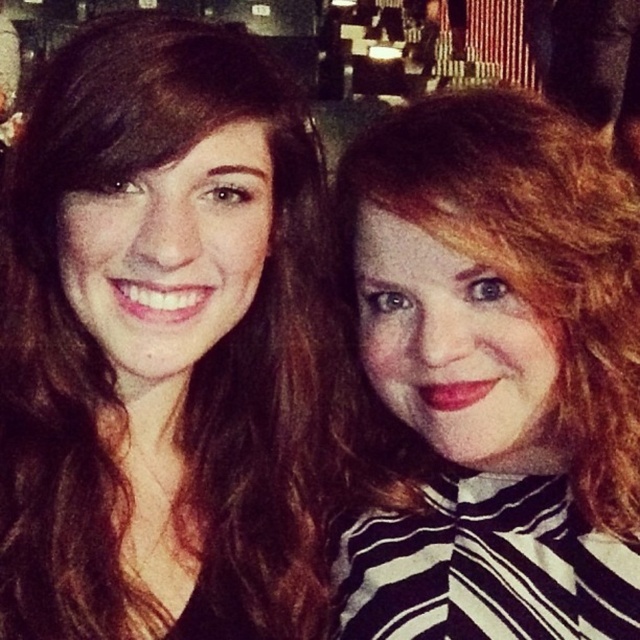
Question: Which of the following is the farthest from the observer?

Choices:
 (A) matte black hair at right
 (B) matte black hair at left

Answer: (A)

Question: Among these points, which one is farthest from the camera?

Choices:
 (A) (508, 314)
 (B) (19, 419)

Answer: (B)

Question: Is matte black hair at left in front of matte black hair at right?

Choices:
 (A) no
 (B) yes

Answer: (B)

Question: Which of the following is the farthest from the observer?

Choices:
 (A) matte black hair at left
 (B) matte black hair at right

Answer: (B)

Question: Can you confirm if matte black hair at left is thinner than matte black hair at right?

Choices:
 (A) yes
 (B) no

Answer: (B)

Question: Does matte black hair at left come in front of matte black hair at right?

Choices:
 (A) no
 (B) yes

Answer: (B)